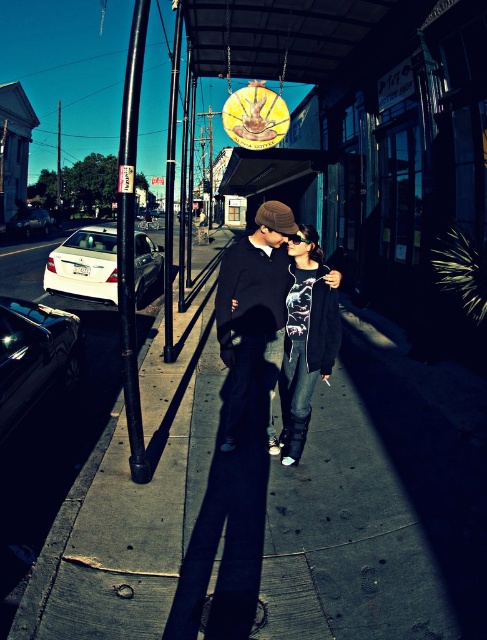
You are a delivery person who needs to place a package on the dark concrete sidewalk at center. The package has coordinates at point A. If the sidewalk is represented by point B, which is at point B, can you confirm whether the package is on the sidewalk?

The dark concrete sidewalk at center is located at point B, which is at coordinates point B. Since the package is at point A, it is not on the sidewalk.

You are a pedestrian standing on the dark concrete sidewalk at center. You want to reach the smooth black pole at center to tie a ribbon. Is the pole above or below you?

The dark concrete sidewalk at center is located below smooth black pole at center, so the pole is above you.

You are a delivery person carrying a large box that is 3 feet wide. You need to walk between the dark concrete sidewalk at center and the smooth black pole at center. Can you fit through the space between them?

The dark concrete sidewalk at center is 7.17 feet from the smooth black pole at center. Since your box is 3 feet wide, you can easily fit through the space between them as the distance is more than sufficient.